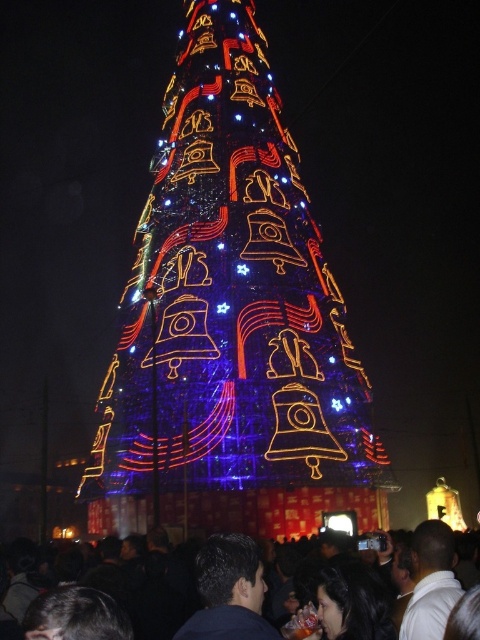
You are standing at the point marked as point (141, 589). Looking around, you see the black matte crowd at lower center. Where are you in relation to the crowd?

You are in the black matte crowd at lower center because the point marks their location.

You are standing in front of the large Christmas tree and see a point marked at coordinates (229, 300). Can you tell me what object this point is located on?

The point at coordinates (229, 300) is located on the illuminated glass Christmas tree at center.

You are standing in front of the Christmas tree and want to take a photo of both the point at coordinates point (x=104, y=548) and point (x=230, y=532). Since you want both points to be in focus, which point should you focus on to ensure both are sharp?

You should focus on the point that is further away from the camera, which is point (x=230, y=532), to ensure both points are in focus. This is because focusing on the further point creates a depth of field that includes the closer point as well.